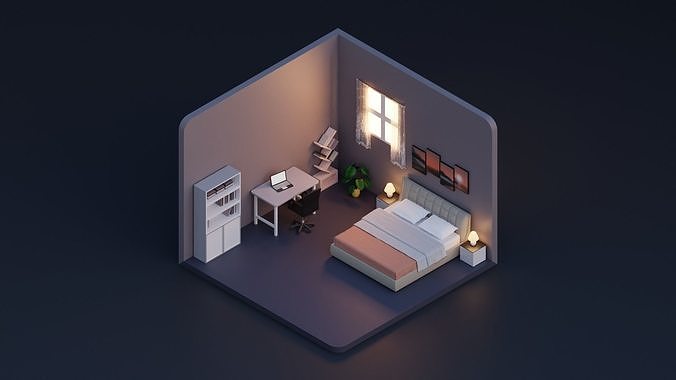
Locate an element on the screen. This screenshot has height=380, width=676. bed is located at coordinates (426, 246).